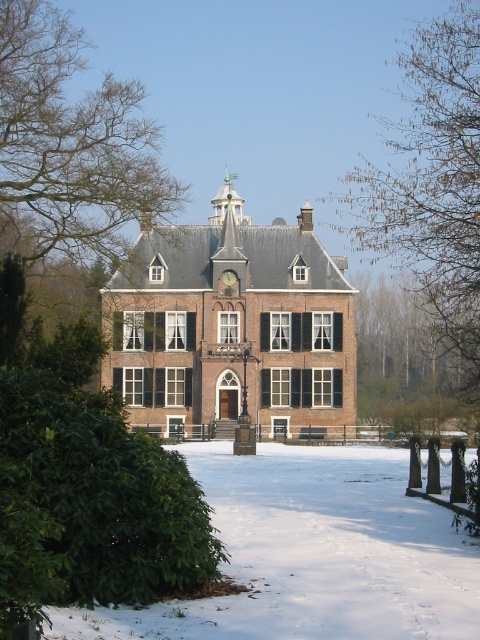
Is green leafy bush at lower left above bare branches at left?

No, green leafy bush at lower left is not above bare branches at left.

Image resolution: width=480 pixels, height=640 pixels. Describe the element at coordinates (91, 506) in the screenshot. I see `green leafy bush at lower left` at that location.

I want to click on green leafy bush at lower left, so click(x=91, y=506).

This screenshot has height=640, width=480. What do you see at coordinates (71, 144) in the screenshot?
I see `bare branches at left` at bounding box center [71, 144].

Which is in front, point (71, 61) or point (372, 209)?

Point (71, 61) is more forward.

Between point (163, 209) and point (379, 237), which one is positioned behind?

Point (379, 237)

Image resolution: width=480 pixels, height=640 pixels. Find the location of `bare branches at left`. bare branches at left is located at coordinates (71, 144).

Which is in front, point (374, 630) or point (444, 58)?

Positioned in front is point (374, 630).

Is point (237, 497) closer to viewer compared to point (406, 225)?

Yes, point (237, 497) is closer to viewer.

Identify the location of white powdery snow at lower center. (313, 554).